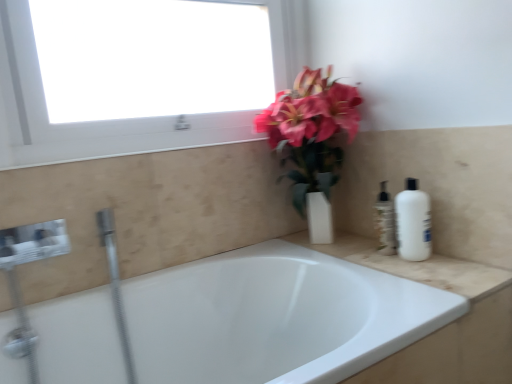
Where is `free region on the left part of white matte bottle at right`? The height and width of the screenshot is (384, 512). free region on the left part of white matte bottle at right is located at coordinates (378, 259).